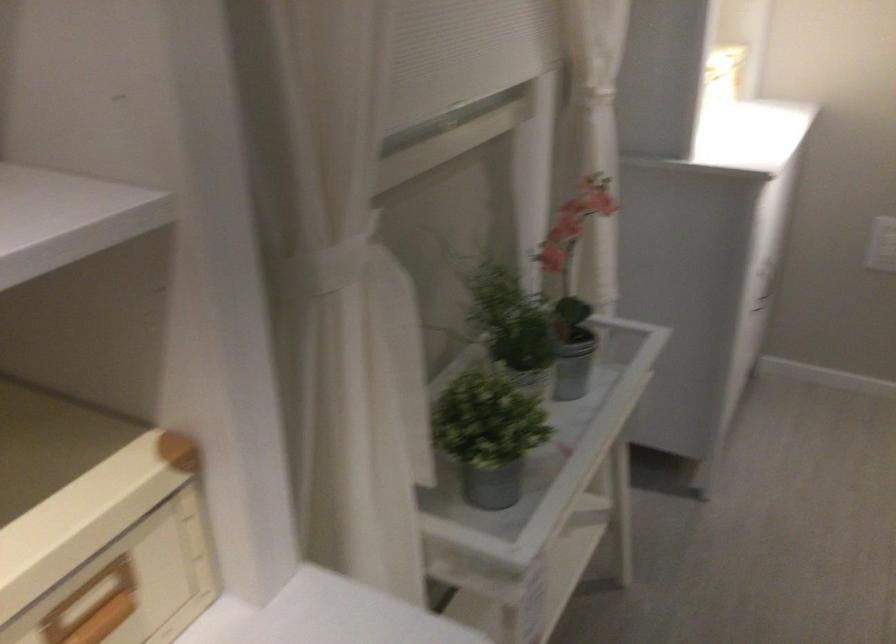
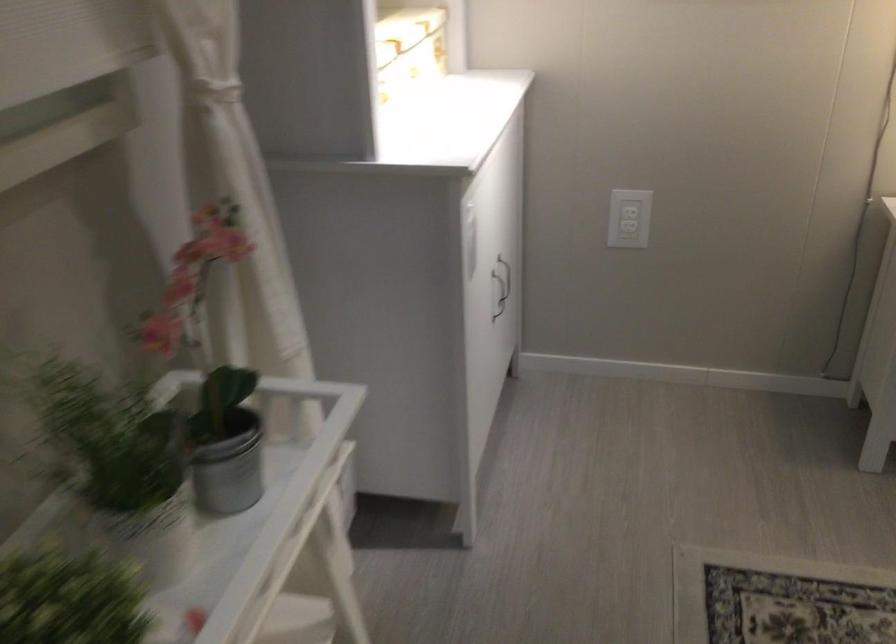
Locate, in the second image, the point that corresponds to the point at 776,277 in the first image.

(505, 277)